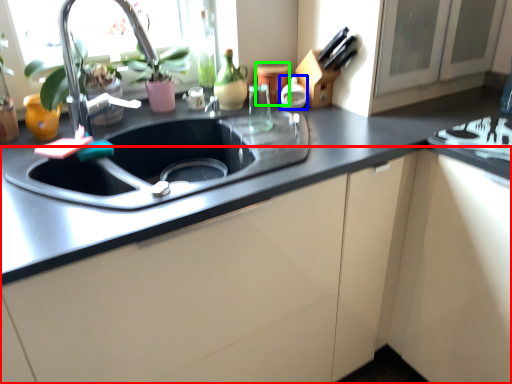
Question: Estimate the real-world distances between objects in this image. Which object is farther from cabinetry (highlighted by a red box), appliance (highlighted by a blue box) or appliance (highlighted by a green box)?

Choices:
 (A) appliance
 (B) appliance

Answer: (B)